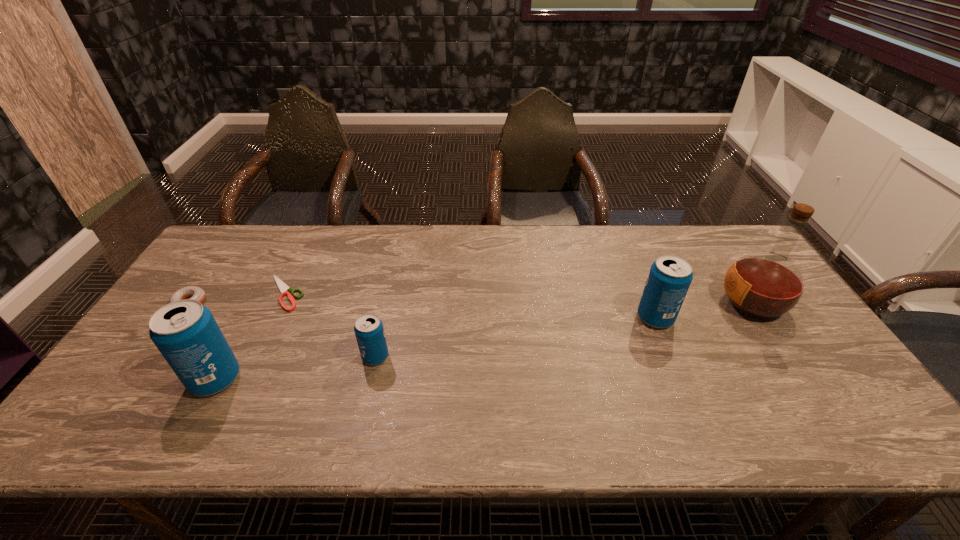
Where is `free space that is in between the shortest object and the tallest object`? Image resolution: width=960 pixels, height=540 pixels. free space that is in between the shortest object and the tallest object is located at coordinates (518, 298).

At what (x,y) coordinates should I click in order to perform the action: click on empty location between the third object from right to left and the leftmost soda can. Please return your answer as a coordinate pair (x, y). Looking at the image, I should click on (296, 368).

Locate an element on the screen. Image resolution: width=960 pixels, height=540 pixels. free space between the third tallest object and the leftmost object is located at coordinates (422, 310).

Find the location of a particular element. free area in between the leftmost object and the third tallest object is located at coordinates (422, 310).

This screenshot has height=540, width=960. I want to click on free spot between the shortest soda can and the rightmost object, so click(564, 330).

Identify the location of object that is the fifth closest to the leftmost object. This screenshot has width=960, height=540. (764, 285).

Identify the location of object that stands as the second closest to the shortest soda can. (185, 332).

At what (x,y) coordinates should I click in order to perform the action: click on soda can that can be found as the second closest to the leftmost soda can. Please return your answer as a coordinate pair (x, y). The image size is (960, 540). Looking at the image, I should click on (670, 276).

Find the location of a particular element. the second closest soda can to the liquor is located at coordinates (369, 331).

Identify the location of vacant space that satisfies the following two spatial constraints: 1. on the back side of the second tallest soda can; 2. on the left side of the leftmost soda can. This screenshot has width=960, height=540. (249, 318).